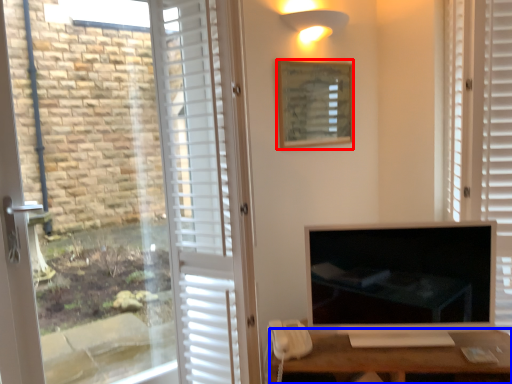
Question: Among these objects, which one is nearest to the camera, picture frame (highlighted by a red box) or desk (highlighted by a blue box)?

Choices:
 (A) picture frame
 (B) desk

Answer: (B)